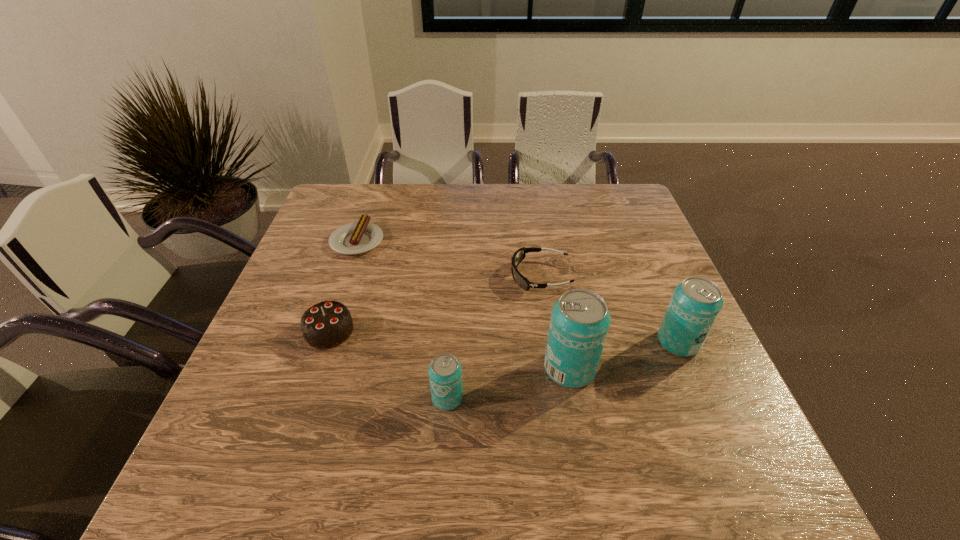
In order to click on vacant spot to place a beer can on the left in this screenshot , I will do `click(310, 431)`.